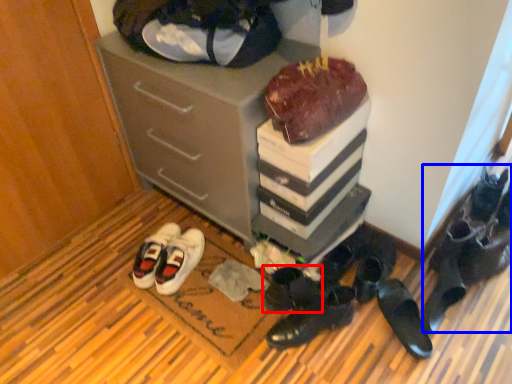
Question: Which point is closer to the camera, footwear (highlighted by a red box) or footwear (highlighted by a blue box)?

Choices:
 (A) footwear
 (B) footwear

Answer: (A)